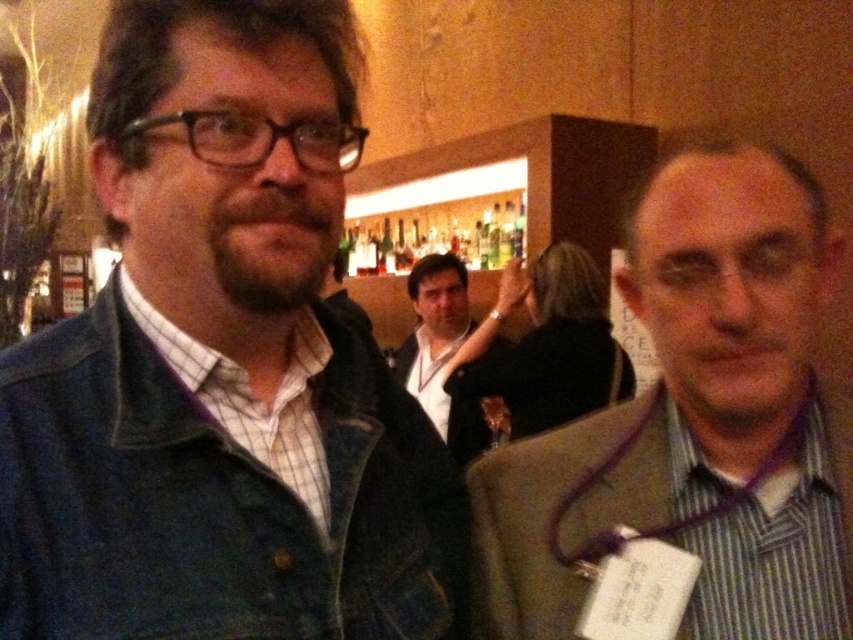
You are a photographer at the event and need to capture a photo that includes both the striped fabric shirt at right and the black leather jacket at center. What is the minimum distance you should position your camera from the subjects to ensure both are in frame?

The striped fabric shirt at right and black leather jacket at center are 6.25 feet apart from each other. To include both in the frame, the camera should be positioned at least 6.25 feet away from the closer subject.

You are organizing a clothing donation drive and need to determine which items can fit into a small donation box. The box can only accommodate items smaller than the black leather jacket at center. Based on the scene, can the striped fabric shirt at right be placed in the box?

The striped fabric shirt at right is smaller than the black leather jacket at center, so it can fit into the donation box designed for items smaller than the black leather jacket at center.